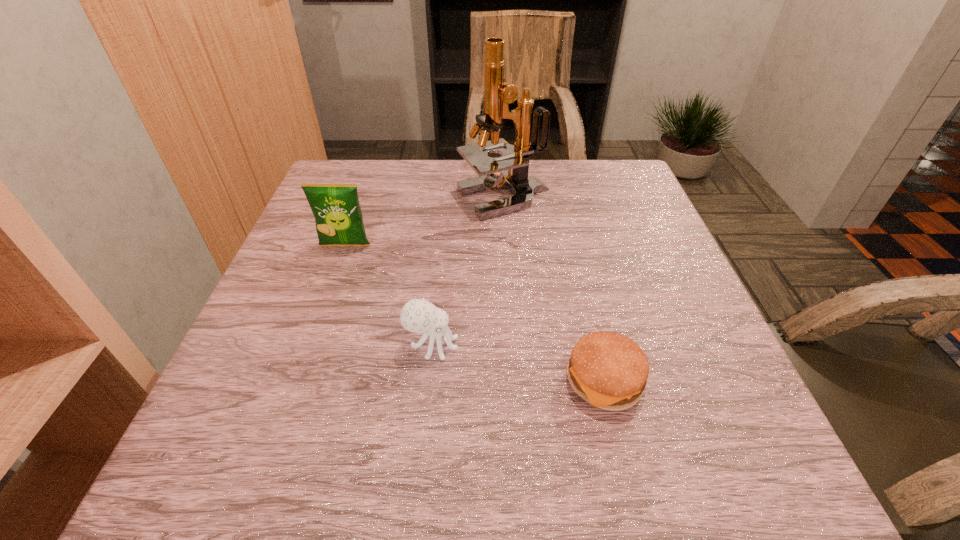
What are the coordinates of `object that stands as the second closest to the octopus` in the screenshot? It's located at 338,217.

Locate which object ranks in proximity to the shortest object. Please provide its 2D coordinates. Your answer should be formatted as a tuple, i.e. [(x, y)], where the tuple contains the x and y coordinates of a point satisfying the conditions above.

[(419, 316)]

The height and width of the screenshot is (540, 960). I want to click on vacant space that satisfies the following two spatial constraints: 1. at the eyepiece of the tallest object; 2. on the back side of the shortest object, so click(516, 381).

At what (x,y) coordinates should I click in order to perform the action: click on vacant area that satisfies the following two spatial constraints: 1. at the eyepiece of the farthest object; 2. on the front-facing side of the crisp (potato chip). Please return your answer as a coordinate pair (x, y). The width and height of the screenshot is (960, 540). Looking at the image, I should click on click(x=507, y=246).

Identify the location of vacant area that satisfies the following two spatial constraints: 1. at the eyepiece of the microscope; 2. on the left side of the shortest object. (516, 381).

Identify the location of free space that satisfies the following two spatial constraints: 1. on the front-facing side of the hamburger; 2. on the right side of the leftmost object. (297, 381).

This screenshot has height=540, width=960. In order to click on blank area in the image that satisfies the following two spatial constraints: 1. on the front-facing side of the third tallest object; 2. on the back side of the hamburger in this screenshot , I will do `click(428, 381)`.

I want to click on free space that satisfies the following two spatial constraints: 1. on the front-facing side of the shortest object; 2. on the right side of the second shortest object, so click(428, 381).

Locate an element on the screen. This screenshot has width=960, height=540. free space that satisfies the following two spatial constraints: 1. on the front-facing side of the shortest object; 2. on the left side of the third shortest object is located at coordinates (297, 381).